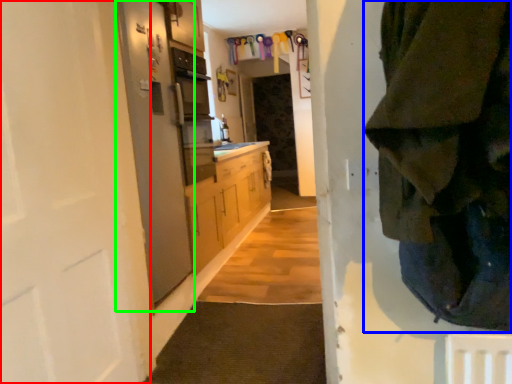
Question: Based on their relative distances, which object is nearer to door (highlighted by a red box)? Choose from clothing (highlighted by a blue box) and screen door (highlighted by a green box).

Choices:
 (A) clothing
 (B) screen door

Answer: (B)